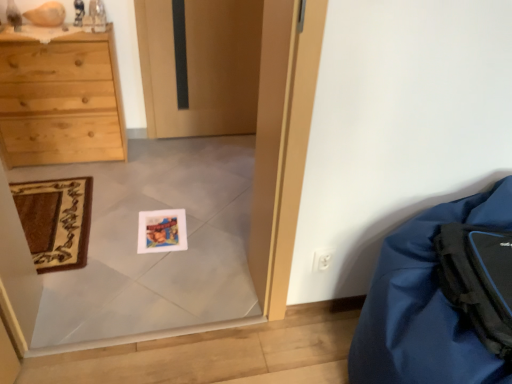
Question: Does black matte backpack at lower right have a greater height compared to blue fabric bean bag at lower right?

Choices:
 (A) yes
 (B) no

Answer: (B)

Question: Is the position of black matte backpack at lower right less distant than that of blue fabric bean bag at lower right?

Choices:
 (A) no
 (B) yes

Answer: (A)

Question: From a real-world perspective, is black matte backpack at lower right on blue fabric bean bag at lower right?

Choices:
 (A) no
 (B) yes

Answer: (B)

Question: Is black matte backpack at lower right smaller than blue fabric bean bag at lower right?

Choices:
 (A) no
 (B) yes

Answer: (B)

Question: From a real-world perspective, is black matte backpack at lower right positioned under blue fabric bean bag at lower right based on gravity?

Choices:
 (A) no
 (B) yes

Answer: (A)

Question: Considering the positions of point (382, 243) and point (480, 309), is point (382, 243) closer or farther from the camera than point (480, 309)?

Choices:
 (A) farther
 (B) closer

Answer: (A)

Question: In terms of width, does blue fabric bean bag at lower right look wider or thinner when compared to black matte backpack at lower right?

Choices:
 (A) thin
 (B) wide

Answer: (B)

Question: From a real-world perspective, is blue fabric bean bag at lower right physically located above or below black matte backpack at lower right?

Choices:
 (A) above
 (B) below

Answer: (B)

Question: From the image's perspective, is blue fabric bean bag at lower right above or below black matte backpack at lower right?

Choices:
 (A) above
 (B) below

Answer: (B)

Question: Considering the positions of black matte backpack at lower right and blue fabric bean bag at lower right in the image, is black matte backpack at lower right taller or shorter than blue fabric bean bag at lower right?

Choices:
 (A) short
 (B) tall

Answer: (A)

Question: From a real-world perspective, relative to blue fabric bean bag at lower right, is black matte backpack at lower right vertically above or below?

Choices:
 (A) above
 (B) below

Answer: (A)

Question: Would you say black matte backpack at lower right is inside or outside blue fabric bean bag at lower right?

Choices:
 (A) inside
 (B) outside

Answer: (A)

Question: Based on their sizes in the image, would you say black matte backpack at lower right is bigger or smaller than blue fabric bean bag at lower right?

Choices:
 (A) small
 (B) big

Answer: (A)

Question: Relative to carpeted mat at lower left, is blue fabric bean bag at lower right in front or behind?

Choices:
 (A) front
 (B) behind

Answer: (A)

Question: Is blue fabric bean bag at lower right taller or shorter than carpeted mat at lower left?

Choices:
 (A) short
 (B) tall

Answer: (B)